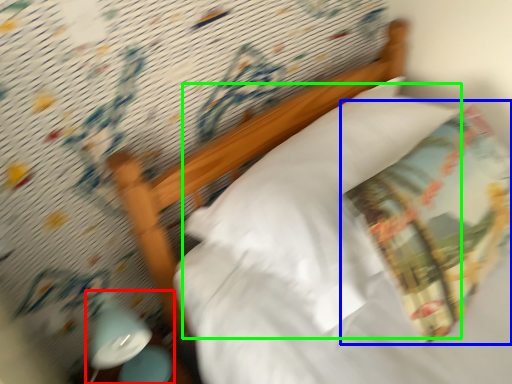
Question: Which is farther away from bedside lamp (highlighted by a red box)? throw pillow (highlighted by a blue box) or pillow (highlighted by a green box)?

Choices:
 (A) throw pillow
 (B) pillow

Answer: (A)